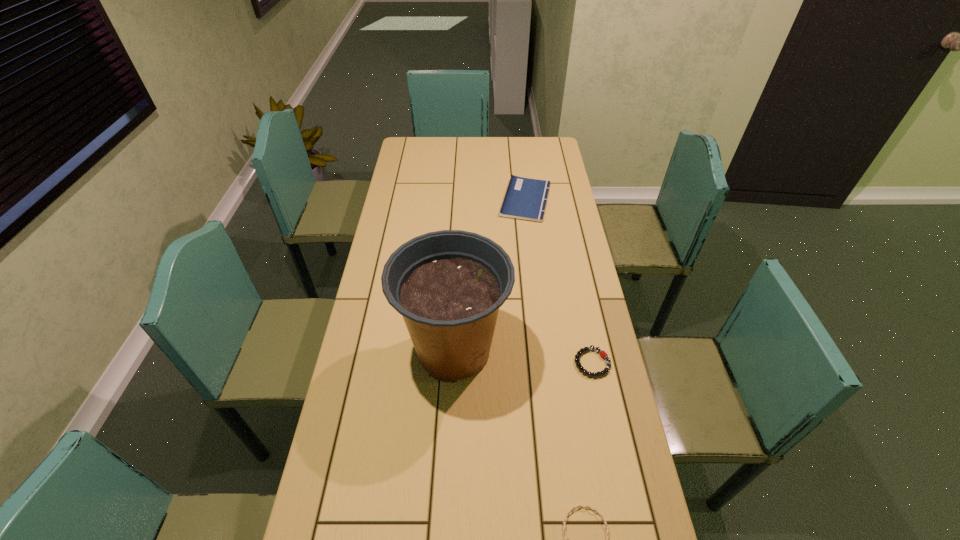
I want to click on bracelet that is positioned at the right edge, so click(x=603, y=354).

At what (x,y) coordinates should I click in order to perform the action: click on vacant space at the far edge. Please return your answer as a coordinate pair (x, y). Looking at the image, I should click on (464, 144).

In the image, there is a desktop. Identify the location of vacant space at the left edge. (389, 208).

Where is `vacant region at the right edge of the desktop`? The height and width of the screenshot is (540, 960). vacant region at the right edge of the desktop is located at coordinates point(550,314).

What are the coordinates of `vacant space at the far left corner of the desktop` in the screenshot? It's located at (402, 160).

This screenshot has height=540, width=960. I want to click on vacant space that is in between the tallest object and the second shortest object, so click(523, 357).

At what (x,y) coordinates should I click in order to perform the action: click on free area in between the taller bracelet and the paperback book. Please return your answer as a coordinate pair (x, y). Looking at the image, I should click on (559, 281).

Where is `free space that is in between the flowerpot and the taller bracelet`? The image size is (960, 540). free space that is in between the flowerpot and the taller bracelet is located at coordinates coord(523,357).

At what (x,y) coordinates should I click in order to perform the action: click on vacant point located between the flowerpot and the third tallest object. Please return your answer as a coordinate pair (x, y). Looking at the image, I should click on (523, 357).

At what (x,y) coordinates should I click in order to perform the action: click on free space between the flowerpot and the taller bracelet. Please return your answer as a coordinate pair (x, y). Looking at the image, I should click on (523, 357).